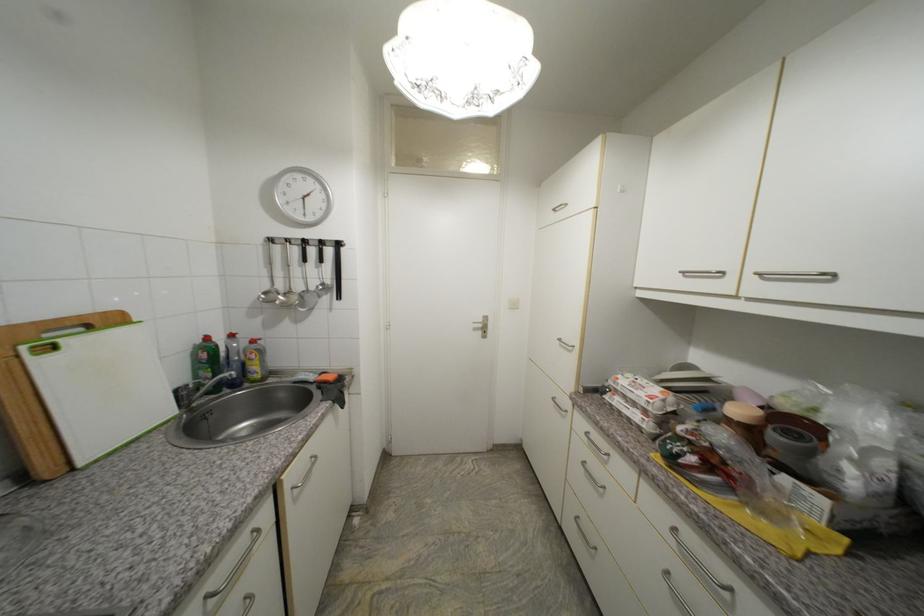
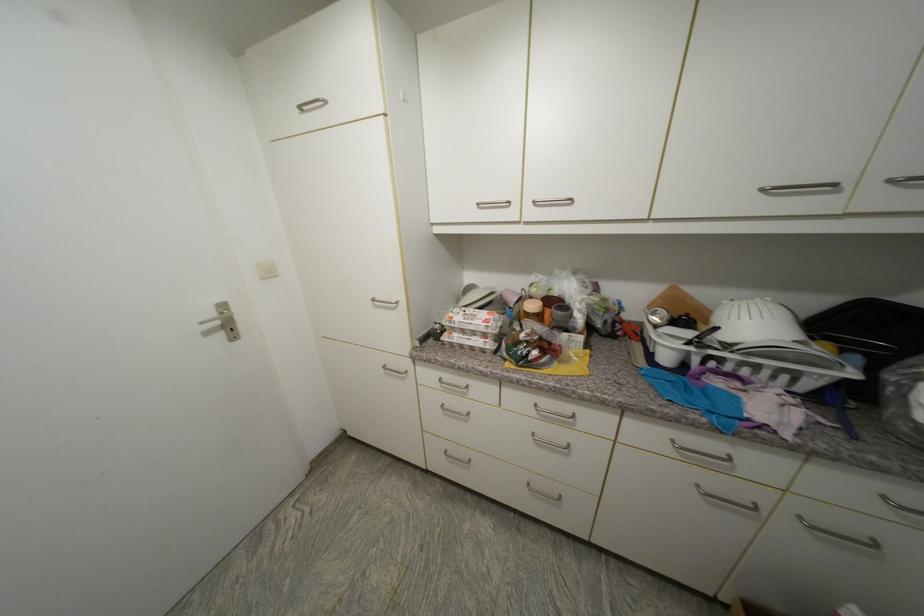
Where in the second image is the point corresponding to point (676, 541) from the first image?

(539, 415)